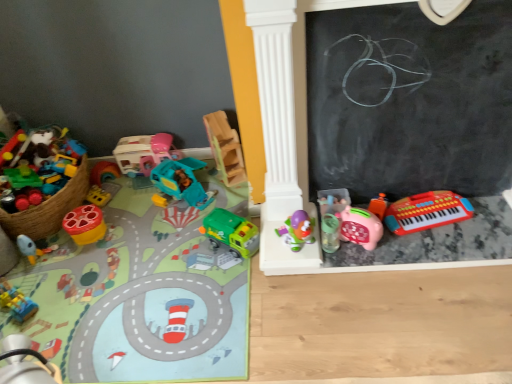
In order to click on vacant area that lies in front of plastic yellow car at lower left, positioned as the 2th toy in left-to-right order in this screenshot , I will do `click(23, 331)`.